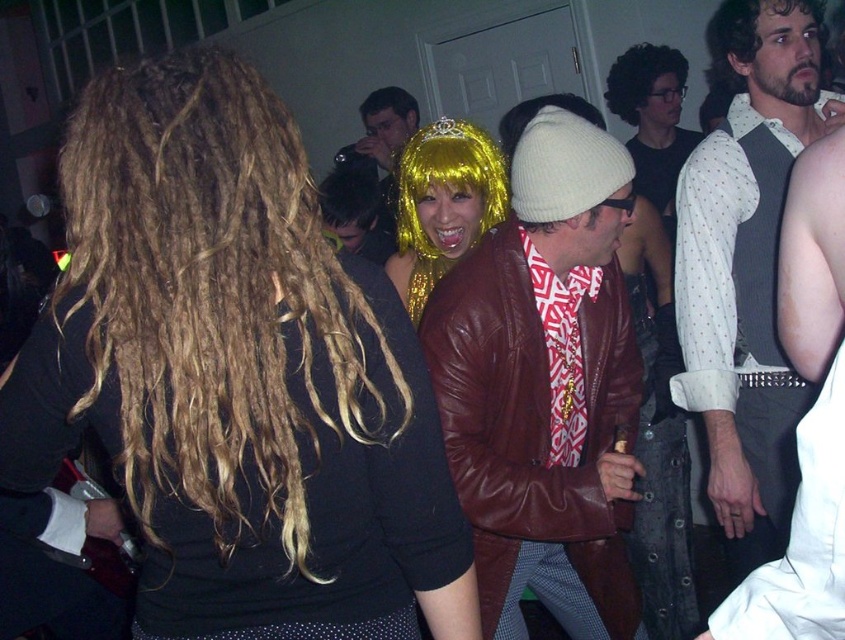
Question: Is golden curly hair at back left bigger than white dotted shirt at upper right?

Choices:
 (A) yes
 (B) no

Answer: (B)

Question: Among these points, which one is nearest to the camera?

Choices:
 (A) (495, 588)
 (B) (615, 109)

Answer: (A)

Question: Does curly brown hair at upper center come behind golden shiny wig at center?

Choices:
 (A) yes
 (B) no

Answer: (B)

Question: Is leather jacket at center wider than curly brown hair at upper center?

Choices:
 (A) no
 (B) yes

Answer: (B)

Question: Which object is positioned closest to the golden shiny wig at center?

Choices:
 (A) leather jacket at center
 (B) white dotted shirt at upper right
 (C) golden curly hair at back left
 (D) sparkly gold wig at center

Answer: (D)

Question: Which object is closer to the camera taking this photo?

Choices:
 (A) white dotted shirt at upper right
 (B) golden curly hair at back left
 (C) leather jacket at center

Answer: (B)